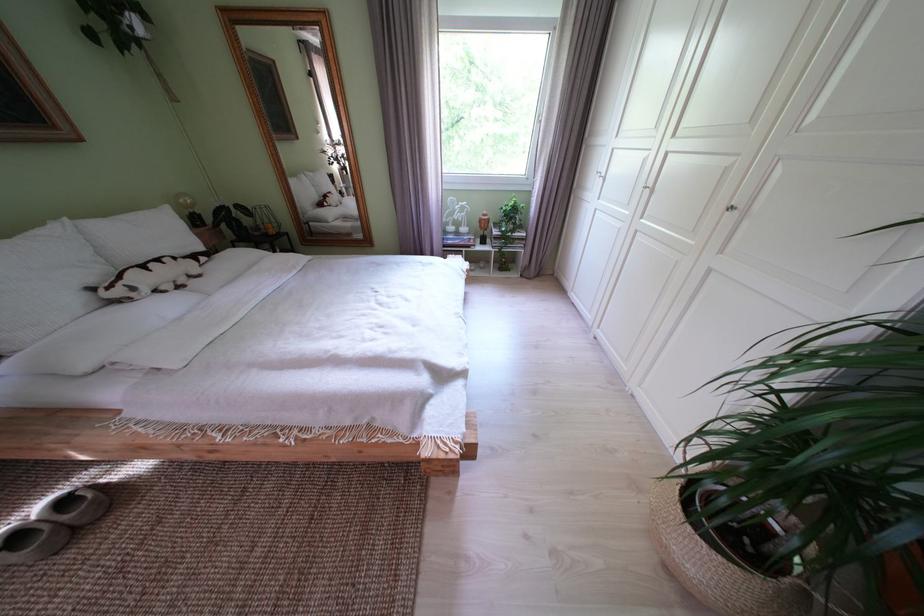
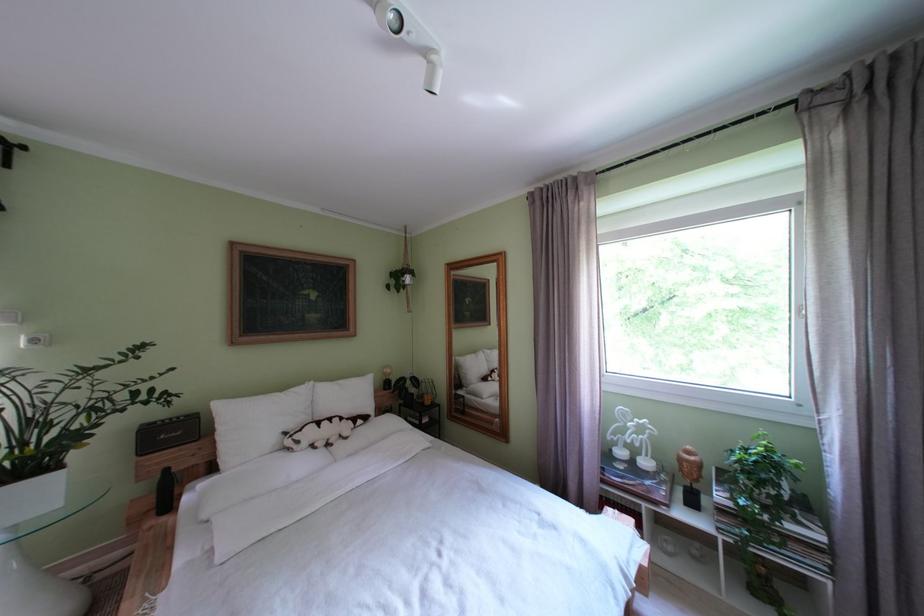
The first image is from the beginning of the video and the second image is from the end. How did the camera likely rotate when shooting the video?

The camera's rotation is toward left-up.